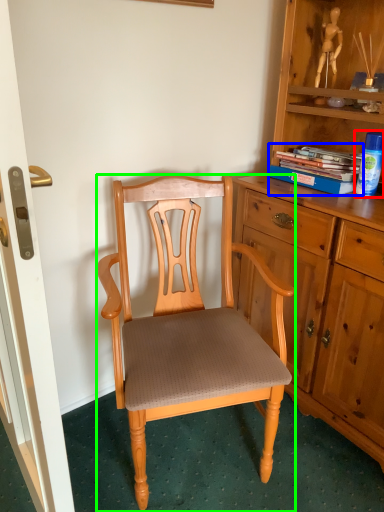
Question: Which is farther away from toy (highlighted by a red box)? book (highlighted by a blue box) or chair (highlighted by a green box)?

Choices:
 (A) book
 (B) chair

Answer: (B)